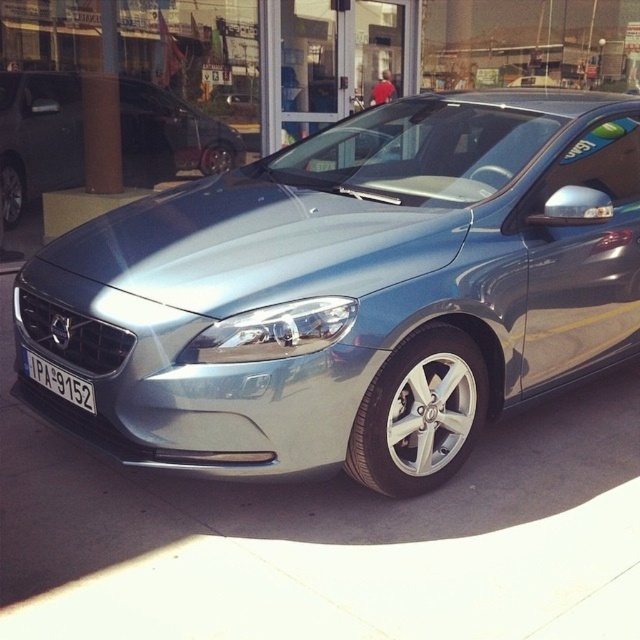
Who is positioned more to the right, satin silver car at center or white plastic license plate at center?

Positioned to the right is white plastic license plate at center.

Can you confirm if satin silver car at center is thinner than white plastic license plate at center?

No.

Does point (193, 118) come farther from viewer compared to point (33, 358)?

Yes, point (193, 118) is farther from viewer.

In order to click on satin silver car at center in this screenshot , I will do `click(38, 138)`.

Consider the image. Who is positioned more to the left, metallic pavement at lower center or satin silver car at center?

satin silver car at center

Between point (186, 486) and point (225, 134), which one is positioned behind?

The point (225, 134) is more distant.

This screenshot has width=640, height=640. Identify the location of metallic pavement at lower center. (326, 536).

I want to click on metallic pavement at lower center, so click(x=326, y=536).

Is metallic pavement at lower center positioned at the back of white plastic license plate at center?

No, it is not.

Who is higher up, metallic pavement at lower center or white plastic license plate at center?

Positioned higher is white plastic license plate at center.

Is point (355, 563) positioned after point (61, 381)?

No, it is not.

This screenshot has width=640, height=640. What are the coordinates of `metallic pavement at lower center` in the screenshot? It's located at (326, 536).